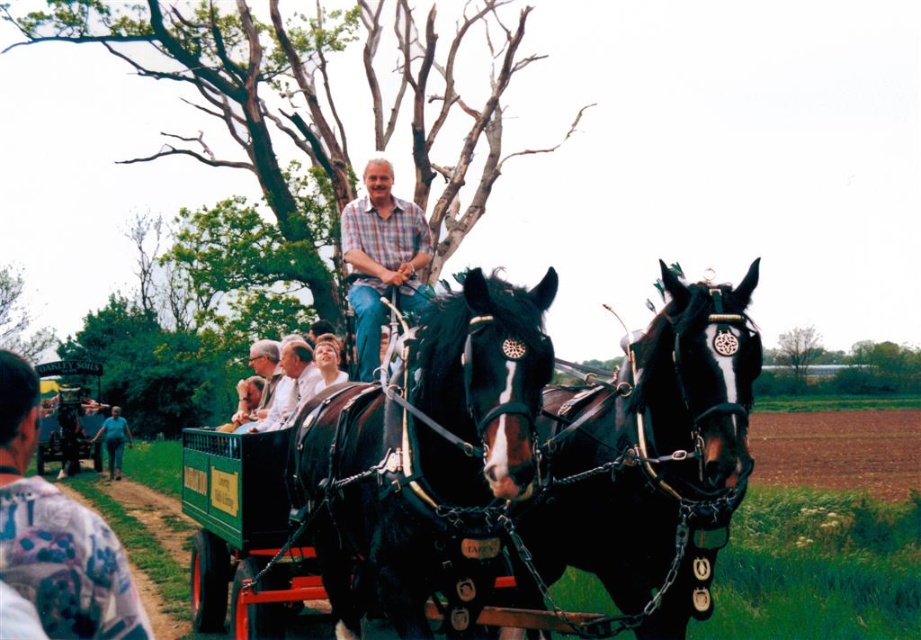
You are a photographer trying to capture the shiny black horse at center and the blue jeans at lower left in the same frame. Which object should you focus on first to ensure both are in the frame without moving the camera?

You should focus on the shiny black horse at center first because it is thinner than the blue jeans at lower left, meaning it requires less space. This allows you to adjust the camera angle to include both objects without moving the camera.

You are a tailor measuring fabrics for a repair job. You have a piece of fabric that is exactly the same width as the blue jeans at lower left. Can you use this fabric to replace the narrower black leather harness at center?

The black leather harness at center has a lesser width compared to the blue jeans at lower left. Since the fabric matches the width of the blue jeans at lower left, it would be sufficient to replace the narrower black leather harness at center.

You are a photographer standing at the edge of a field. You want to take a photo of the shiny black horse at center and the green wooden cart at center. Given that your camera can focus clearly on objects within 25 meters, will both subjects be in focus?

The distance between the shiny black horse at center and the green wooden cart at center is 27.09 meters, which exceeds the camera focus range of 25 meters. Therefore, both subjects cannot be in focus simultaneously.